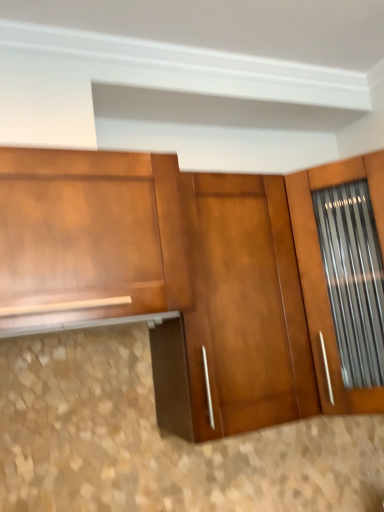
The height and width of the screenshot is (512, 384). What do you see at coordinates (246, 303) in the screenshot? I see `glossy wood door at center` at bounding box center [246, 303].

At what (x,y) coordinates should I click in order to perform the action: click on glossy wood door at center. Please return your answer as a coordinate pair (x, y). The height and width of the screenshot is (512, 384). Looking at the image, I should click on (246, 303).

This screenshot has height=512, width=384. I want to click on shiny brown cabinet at left, so click(85, 238).

Image resolution: width=384 pixels, height=512 pixels. Describe the element at coordinates (85, 238) in the screenshot. I see `shiny brown cabinet at left` at that location.

You are a GUI agent. You are given a task and a screenshot of the screen. Output one action in this format:
    pyautogui.click(x=<x>, y=<y>)
    Task: Click on the glossy wood door at center
    
    Given the screenshot: What is the action you would take?
    pyautogui.click(x=246, y=303)

Between glossy wood door at center and shiny brown cabinet at left, which one appears on the left side from the viewer's perspective?

From the viewer's perspective, shiny brown cabinet at left appears more on the left side.

Is glossy wood door at center behind shiny brown cabinet at left?

That is True.

Is point (214, 344) behind point (113, 189)?

Yes, it is.

From the image's perspective, is glossy wood door at center on shiny brown cabinet at left?

No, from the image's perspective, glossy wood door at center is not above shiny brown cabinet at left.

From a real-world perspective, does glossy wood door at center stand above shiny brown cabinet at left?

No, from a real-world perspective, glossy wood door at center is not over shiny brown cabinet at left

In terms of width, does glossy wood door at center look wider or thinner when compared to shiny brown cabinet at left?

glossy wood door at center is thinner than shiny brown cabinet at left.

From their relative heights in the image, would you say glossy wood door at center is taller or shorter than shiny brown cabinet at left?

In the image, glossy wood door at center appears to be taller than shiny brown cabinet at left.

Who is bigger, glossy wood door at center or shiny brown cabinet at left?

With larger size is glossy wood door at center.

Would you say glossy wood door at center is inside or outside shiny brown cabinet at left?

glossy wood door at center is spatially situated outside shiny brown cabinet at left.

Is glossy wood door at center with shiny brown cabinet at left?

No, glossy wood door at center is not making contact with shiny brown cabinet at left.

Looking at this image, does glossy wood door at center turn towards shiny brown cabinet at left?

No, glossy wood door at center is not turned towards shiny brown cabinet at left.

Measure the distance from glossy wood door at center to shiny brown cabinet at left.

A distance of 10.89 inches exists between glossy wood door at center and shiny brown cabinet at left.

Where is `cabinetry above the glossy wood door at center (from the image's perspective)`? cabinetry above the glossy wood door at center (from the image's perspective) is located at coordinates (85, 238).

Which object is positioned more to the right, shiny brown cabinet at left or glossy wood door at center?

glossy wood door at center is more to the right.

Is shiny brown cabinet at left behind glossy wood door at center?

No, shiny brown cabinet at left is in front of glossy wood door at center.

Is point (138, 245) closer to camera compared to point (299, 342)?

Yes, it is in front of point (299, 342).

From the image's perspective, between shiny brown cabinet at left and glossy wood door at center, which one is located above?

From the image's view, shiny brown cabinet at left is above.

From a real-world perspective, is shiny brown cabinet at left under glossy wood door at center?

No, from a real-world perspective, shiny brown cabinet at left is not beneath glossy wood door at center.

Considering the relative sizes of shiny brown cabinet at left and glossy wood door at center in the image provided, is shiny brown cabinet at left thinner than glossy wood door at center?

No, shiny brown cabinet at left is not thinner than glossy wood door at center.

Considering the sizes of objects shiny brown cabinet at left and glossy wood door at center in the image provided, who is shorter, shiny brown cabinet at left or glossy wood door at center?

shiny brown cabinet at left.

Considering the sizes of shiny brown cabinet at left and glossy wood door at center in the image, is shiny brown cabinet at left bigger or smaller than glossy wood door at center?

Clearly, shiny brown cabinet at left is smaller in size than glossy wood door at center.

Can glossy wood door at center be found inside shiny brown cabinet at left?

Definitely not — glossy wood door at center is not inside shiny brown cabinet at left.

Based on the photo, is shiny brown cabinet at left not close to glossy wood door at center?

Actually, shiny brown cabinet at left and glossy wood door at center are a little close together.

Is shiny brown cabinet at left positioned with its back to glossy wood door at center?

No.

How different are the orientations of shiny brown cabinet at left and glossy wood door at center in degrees?

The facing directions of shiny brown cabinet at left and glossy wood door at center are 0.946 degrees apart.

Find the location of a particular element. The width and height of the screenshot is (384, 512). cabinetry that is above the glossy wood door at center (from the image's perspective) is located at coordinates (85, 238).

Identify the location of cabinetry above the glossy wood door at center (from a real-world perspective). (85, 238).

I want to click on door behind the shiny brown cabinet at left, so click(x=246, y=303).